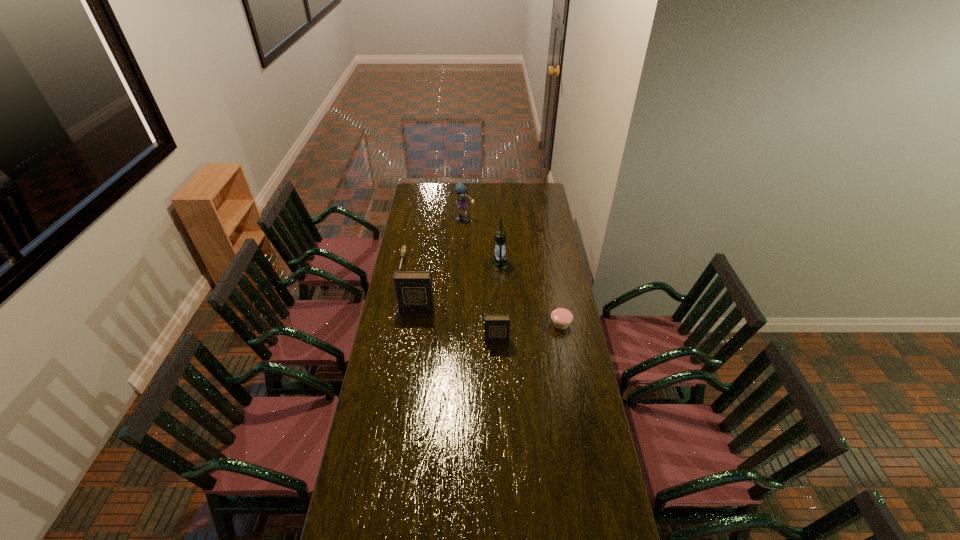
What are the coordinates of `vacant point that satisfies the following two spatial constraints: 1. on the side where the lantern emits light; 2. on the front cover of the right diary` in the screenshot? It's located at (503, 340).

In order to click on vacant space that satisfies the following two spatial constraints: 1. at the tip of the leftmost object; 2. on the left side of the second shortest object in this screenshot , I will do `click(390, 323)`.